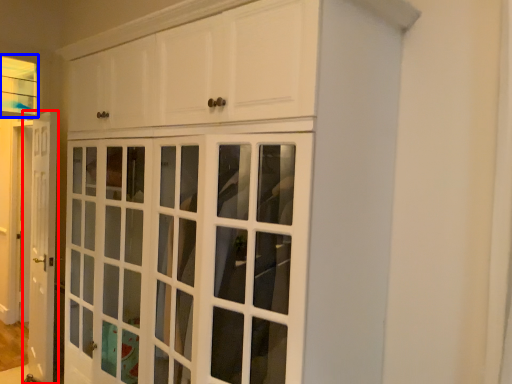
Question: Which of the following is the farthest to the observer, door (highlighted by a red box) or window (highlighted by a blue box)?

Choices:
 (A) door
 (B) window

Answer: (B)